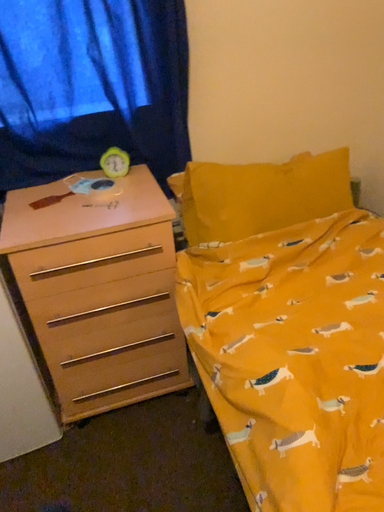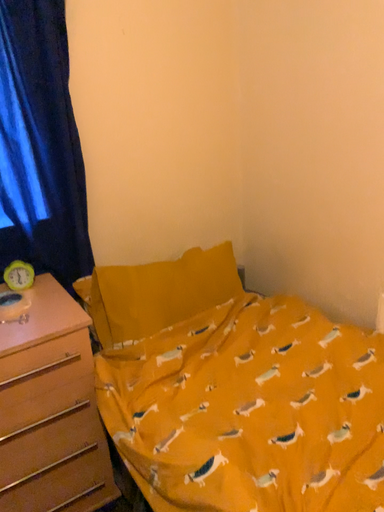
Question: How did the camera likely rotate when shooting the video?

Choices:
 (A) rotated right
 (B) rotated left

Answer: (A)